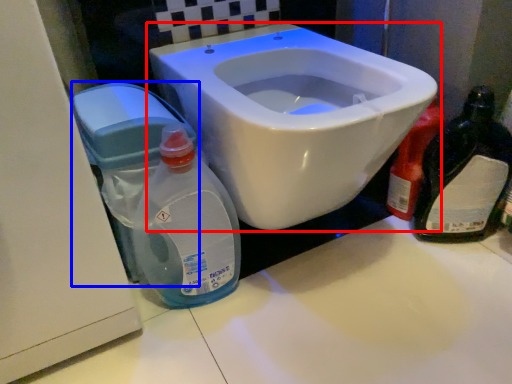
Question: Which object appears closest to the camera in this image, toilet (highlighted by a red box) or water tank (highlighted by a blue box)?

Choices:
 (A) toilet
 (B) water tank

Answer: (A)